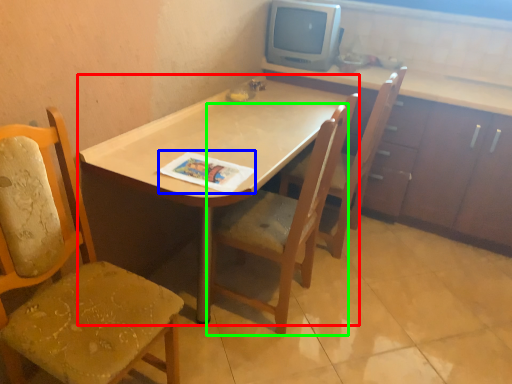
Question: Which object is the farthest from desk (highlighted by a red box)? Choose among these: magazine (highlighted by a blue box) or chair (highlighted by a green box).

Choices:
 (A) magazine
 (B) chair

Answer: (B)